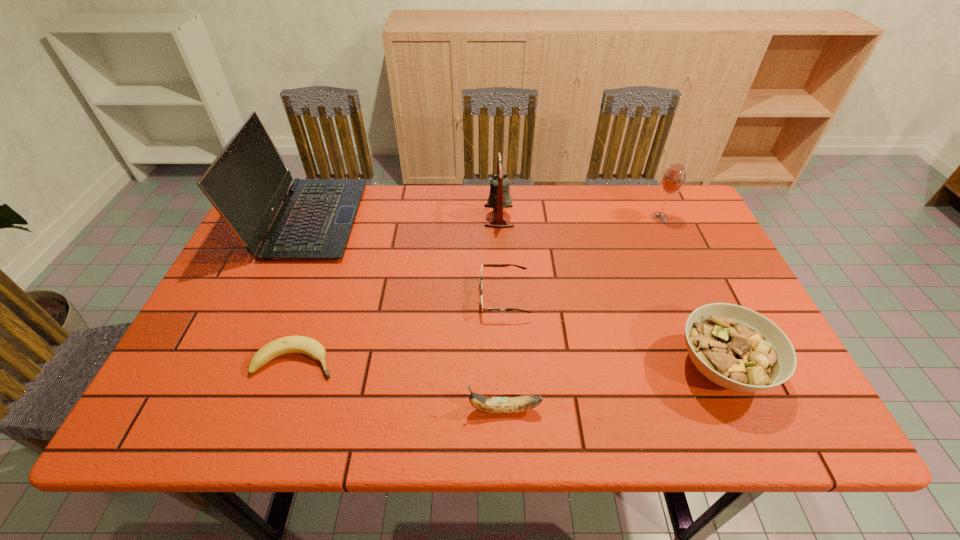
Where is `empty location between the laptop computer and the right banana`? The image size is (960, 540). empty location between the laptop computer and the right banana is located at coordinates (406, 314).

Where is `free space between the wineglass and the farther banana`? free space between the wineglass and the farther banana is located at coordinates (477, 289).

Identify the location of empty space between the farther banana and the stew. (509, 364).

The width and height of the screenshot is (960, 540). Identify the location of vacant space that is in between the laptop computer and the fourth farthest object. (406, 258).

This screenshot has width=960, height=540. In order to click on empty location between the shortest object and the stew in this screenshot , I will do `click(509, 364)`.

The height and width of the screenshot is (540, 960). Find the location of `vacant space in between the taller banana and the spectacles`. vacant space in between the taller banana and the spectacles is located at coordinates (504, 353).

At what (x,y) coordinates should I click in order to perform the action: click on vacant region between the spectacles and the tallest object. Please return your answer as a coordinate pair (x, y). The height and width of the screenshot is (540, 960). Looking at the image, I should click on (406, 258).

The height and width of the screenshot is (540, 960). What are the coordinates of `empty location between the left banana and the sixth tallest object` in the screenshot? It's located at (399, 329).

This screenshot has width=960, height=540. I want to click on the third closest object to the second shortest object, so click(x=737, y=348).

Locate which object is the third closest to the bell. Please provide its 2D coordinates. Your answer should be formatted as a tuple, i.e. [(x, y)], where the tuple contains the x and y coordinates of a point satisfying the conditions above.

[(673, 179)]